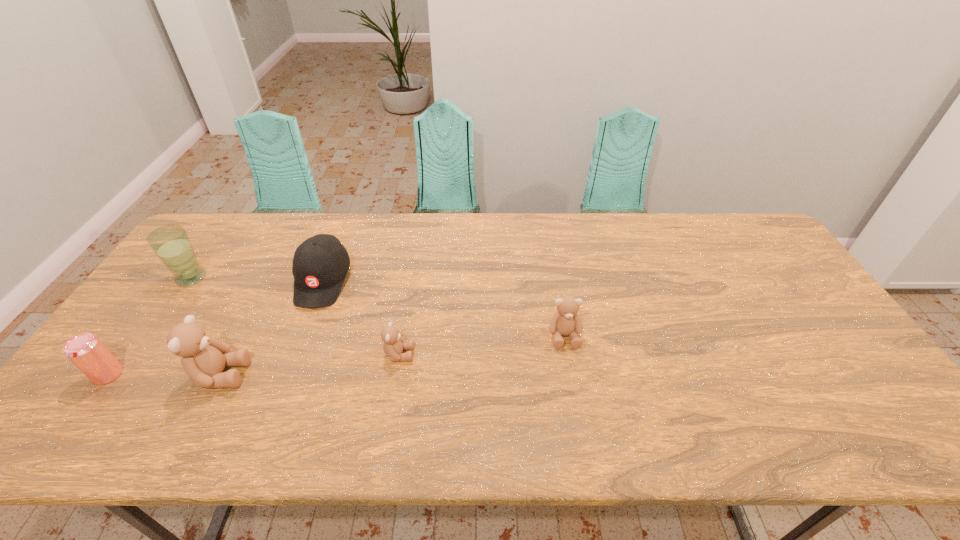
What are the coordinates of `the leftmost teddy bear` in the screenshot? It's located at (203, 359).

Where is `the tallest teddy bear`? The height and width of the screenshot is (540, 960). the tallest teddy bear is located at coordinates (203, 359).

Find the location of a particular element. The width and height of the screenshot is (960, 540). the second teddy bear from right to left is located at coordinates (393, 346).

This screenshot has width=960, height=540. Find the location of `the shortest object`. the shortest object is located at coordinates (393, 346).

This screenshot has width=960, height=540. Find the location of `the second shortest teddy bear`. the second shortest teddy bear is located at coordinates (565, 321).

Where is `the rightmost teddy bear`? the rightmost teddy bear is located at coordinates (565, 321).

Identify the location of glass. This screenshot has width=960, height=540. pos(171,243).

The image size is (960, 540). I want to click on baseball cap, so click(x=320, y=264).

This screenshot has height=540, width=960. What are the coordinates of `beer can` in the screenshot? It's located at (85, 350).

Where is `free space located on the front-facing side of the tallest teddy bear`? Image resolution: width=960 pixels, height=540 pixels. free space located on the front-facing side of the tallest teddy bear is located at coordinates (275, 375).